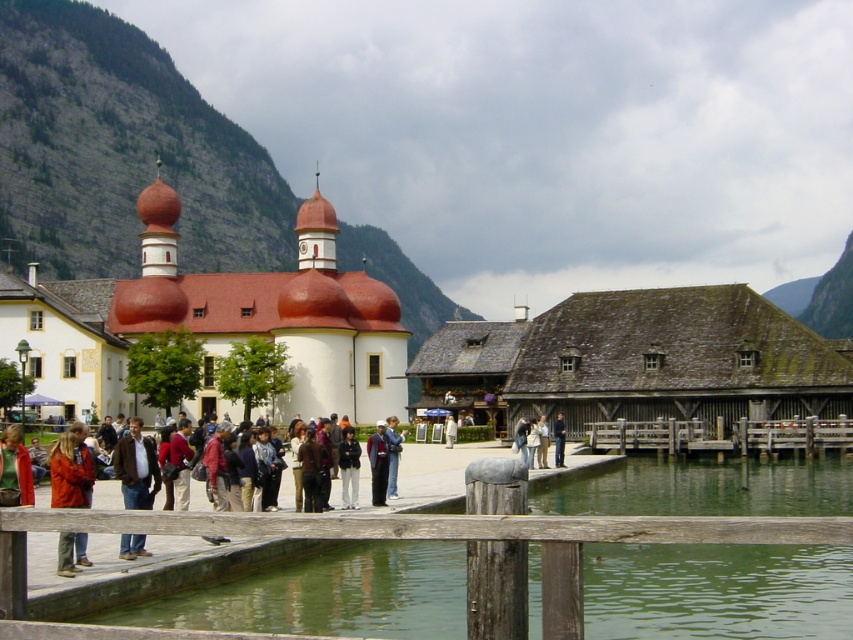
Can you confirm if wooden dock at lower center is shorter than blue denim jacket at center?

No.

Based on the photo, does wooden dock at lower center come in front of blue denim jacket at center?

No, wooden dock at lower center is further to the viewer.

Where is `wooden dock at lower center`? This screenshot has height=640, width=853. wooden dock at lower center is located at coordinates (721, 435).

Is rugged stone mountain at upper left above white matte church at center?

Correct, rugged stone mountain at upper left is located above white matte church at center.

Measure the distance between rugged stone mountain at upper left and camera.

rugged stone mountain at upper left is 93.27 meters from camera.

Locate an element on the screen. The width and height of the screenshot is (853, 640). rugged stone mountain at upper left is located at coordinates (120, 150).

Identify the location of wooden dock at lower center. (721, 435).

Which is above, wooden dock at lower center or brown leather jacket at lower left?

brown leather jacket at lower left is higher up.

Who is more distant from viewer, (782, 444) or (141, 467)?

Answer: Point (782, 444)

Where is `wooden dock at lower center`? wooden dock at lower center is located at coordinates (721, 435).